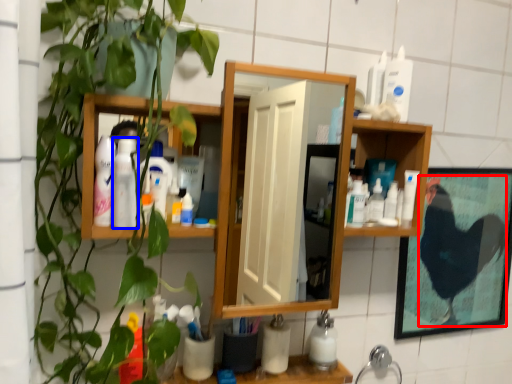
Question: Which object appears closest to the camera in this image, chicken (highlighted by a red box) or toiletry (highlighted by a blue box)?

Choices:
 (A) chicken
 (B) toiletry

Answer: (B)